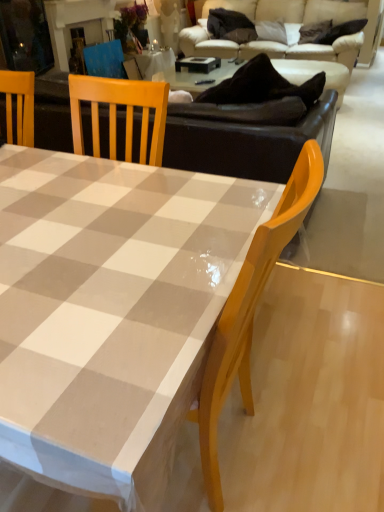
You are a GUI agent. You are given a task and a screenshot of the screen. Output one action in this format:
    pyautogui.click(x=<x>, y=<y>)
    Task: Click on the beige fabric couch at upper center
    
    Given the screenshot: What is the action you would take?
    point(270,48)

Measure the distance between beige fabric couch at upper center and camera.

beige fabric couch at upper center is 17.74 feet from camera.

What do you see at coordinates (270, 48) in the screenshot?
I see `beige fabric couch at upper center` at bounding box center [270, 48].

The image size is (384, 512). What do you see at coordinates (111, 312) in the screenshot?
I see `white glossy table at center` at bounding box center [111, 312].

I want to click on white glossy table at center, so click(x=111, y=312).

This screenshot has height=512, width=384. What are the coordinates of `beige fabric couch at upper center` in the screenshot? It's located at (270, 48).

Can you confirm if white glossy table at center is positioned to the right of beige fabric couch at upper center?

In fact, white glossy table at center is to the left of beige fabric couch at upper center.

Is white glossy table at center in front of beige fabric couch at upper center?

Yes.

Does point (132, 446) come behind point (342, 49)?

No.

From the image's perspective, is white glossy table at center under beige fabric couch at upper center?

Yes, from the image's perspective, white glossy table at center is below beige fabric couch at upper center.

From a real-world perspective, between white glossy table at center and beige fabric couch at upper center, who is vertically lower?

white glossy table at center, from a real-world perspective.

Consider the image. In terms of width, does white glossy table at center look wider or thinner when compared to beige fabric couch at upper center?

Clearly, white glossy table at center has more width compared to beige fabric couch at upper center.

Who is shorter, white glossy table at center or beige fabric couch at upper center?

white glossy table at center is shorter.

Which of these two, white glossy table at center or beige fabric couch at upper center, is bigger?

With larger size is beige fabric couch at upper center.

Is white glossy table at center inside or outside of beige fabric couch at upper center?

white glossy table at center exists outside the volume of beige fabric couch at upper center.

Would you consider white glossy table at center to be distant from beige fabric couch at upper center?

Indeed, white glossy table at center is not near beige fabric couch at upper center.

Is white glossy table at center facing away from beige fabric couch at upper center?

Yes.

Measure the distance from white glossy table at center to beige fabric couch at upper center.

A distance of 5.48 meters exists between white glossy table at center and beige fabric couch at upper center.

Where is `studio couch lying behind the white glossy table at center`? The height and width of the screenshot is (512, 384). studio couch lying behind the white glossy table at center is located at coordinates (270, 48).

Can you confirm if beige fabric couch at upper center is positioned to the left of white glossy table at center?

In fact, beige fabric couch at upper center is to the right of white glossy table at center.

Which object is further away from the camera, beige fabric couch at upper center or white glossy table at center?

beige fabric couch at upper center is more distant.

Does point (256, 54) appear closer or farther from the camera than point (116, 194)?

Point (256, 54).

From the image's perspective, between beige fabric couch at upper center and white glossy table at center, who is located below?

white glossy table at center is shown below in the image.

From a real-world perspective, which object stands above the other?

In real-world perspective, beige fabric couch at upper center is above.

Considering the relative sizes of beige fabric couch at upper center and white glossy table at center in the image provided, is beige fabric couch at upper center thinner than white glossy table at center?

Yes, beige fabric couch at upper center is thinner than white glossy table at center.

Considering the relative sizes of beige fabric couch at upper center and white glossy table at center in the image provided, is beige fabric couch at upper center shorter than white glossy table at center?

No.

Is beige fabric couch at upper center bigger than white glossy table at center?

Yes, beige fabric couch at upper center is bigger than white glossy table at center.

Can we say beige fabric couch at upper center lies outside white glossy table at center?

Yes, beige fabric couch at upper center is located beyond the bounds of white glossy table at center.

Are beige fabric couch at upper center and white glossy table at center far apart?

Yes, beige fabric couch at upper center and white glossy table at center are located far from each other.

Is beige fabric couch at upper center turned away from white glossy table at center?

No, white glossy table at center is not at the back of beige fabric couch at upper center.

How distant is beige fabric couch at upper center from white glossy table at center?

They are 5.48 meters apart.

The height and width of the screenshot is (512, 384). I want to click on studio couch on the right of white glossy table at center, so click(270, 48).

Identify the location of coffee table lying in front of the beige fabric couch at upper center. This screenshot has width=384, height=512. (111, 312).

The height and width of the screenshot is (512, 384). In order to click on studio couch behind the white glossy table at center in this screenshot , I will do `click(270, 48)`.